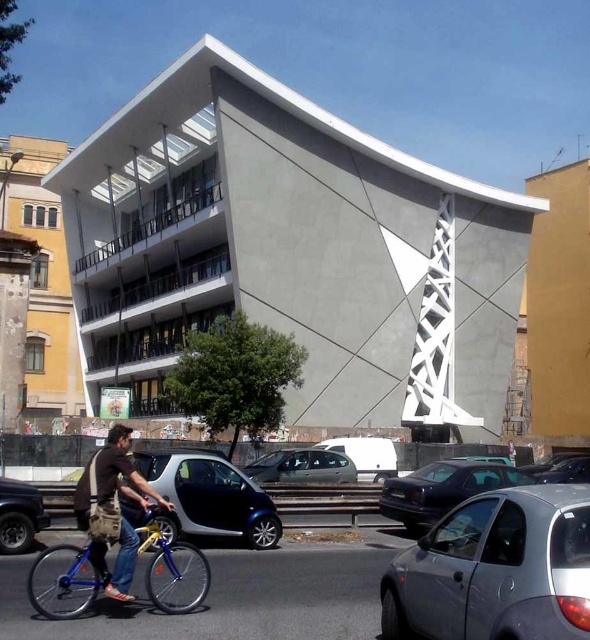
Is point (198, 579) closer to camera compared to point (27, 497)?

Yes, point (198, 579) is closer to viewer.

Between point (57, 595) and point (31, 540), which one is positioned behind?

The point (31, 540) is behind.

Measure the distance between blue metallic bicycle at lower left and camera.

blue metallic bicycle at lower left is 27.30 meters from camera.

This screenshot has width=590, height=640. I want to click on blue metallic bicycle at lower left, so click(172, 570).

Can you confirm if metallic gray hatchback at lower right is wider than black matte truck at lower left?

Correct, the width of metallic gray hatchback at lower right exceeds that of black matte truck at lower left.

Between metallic gray hatchback at lower right and black matte truck at lower left, which one is positioned higher?

black matte truck at lower left is above.

Describe the element at coordinates (496, 570) in the screenshot. The image size is (590, 640). I see `metallic gray hatchback at lower right` at that location.

What are the coordinates of `metallic gray hatchback at lower right` in the screenshot? It's located at (496, 570).

Is dark gray metallic car at center below black matte truck at lower left?

Correct, dark gray metallic car at center is located below black matte truck at lower left.

Based on the photo, does dark gray metallic car at center have a larger size compared to black matte truck at lower left?

Yes, dark gray metallic car at center is bigger than black matte truck at lower left.

Is point (278, 468) less distant than point (31, 545)?

No, it is not.

Where is `dark gray metallic car at center`? dark gray metallic car at center is located at coordinates click(301, 467).